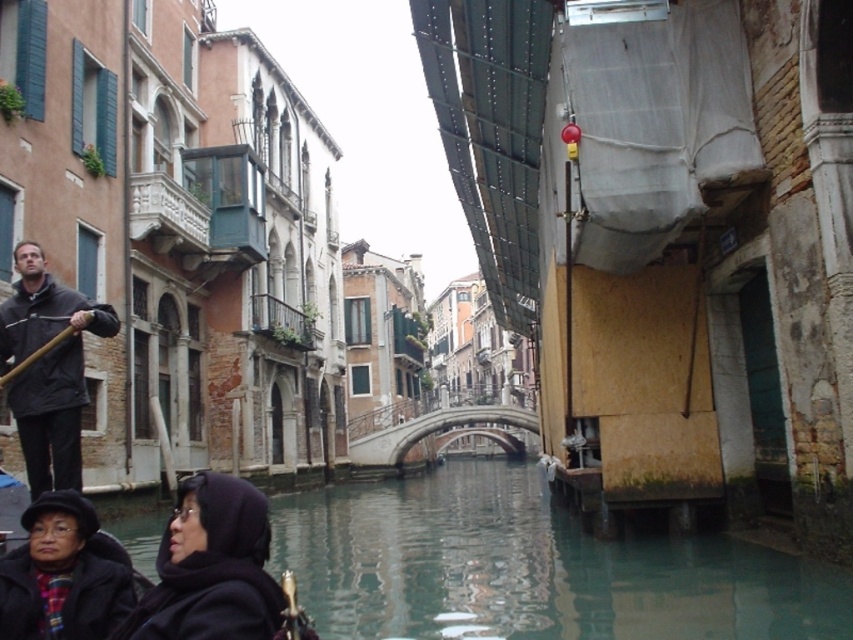
Between point (59, 368) and point (39, 560), which one is positioned behind?

The point (59, 368) is more distant.

Can you confirm if dark gray jacket at left is taller than black woolen hat at lower left?

Yes, dark gray jacket at left is taller than black woolen hat at lower left.

Between point (39, 420) and point (62, 572), which one is positioned behind?

Point (39, 420)

Identify the location of dark gray jacket at left. (48, 369).

Does dark purple fabric headscarf at lower left have a greater height compared to dark gray jacket at left?

No.

Does dark purple fabric headscarf at lower left have a greater width compared to dark gray jacket at left?

Yes, dark purple fabric headscarf at lower left is wider than dark gray jacket at left.

Between point (180, 602) and point (9, 332), which one is positioned behind?

The point (9, 332) is more distant.

In order to click on dark purple fabric headscarf at lower left in this screenshot , I will do `click(212, 566)`.

Is point (132, 520) behind point (50, 339)?

Yes, point (132, 520) is farther from viewer.

Find the location of a particular element. The width and height of the screenshot is (853, 640). greenish water at center is located at coordinates (531, 566).

Where is `greenish water at center`? This screenshot has width=853, height=640. greenish water at center is located at coordinates (531, 566).